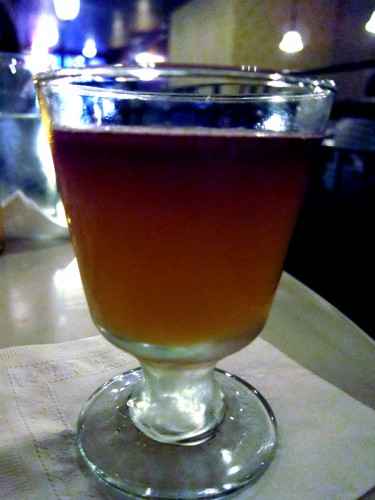
Locate an element on the screen. The image size is (375, 500). stem of glass is located at coordinates (177, 394).